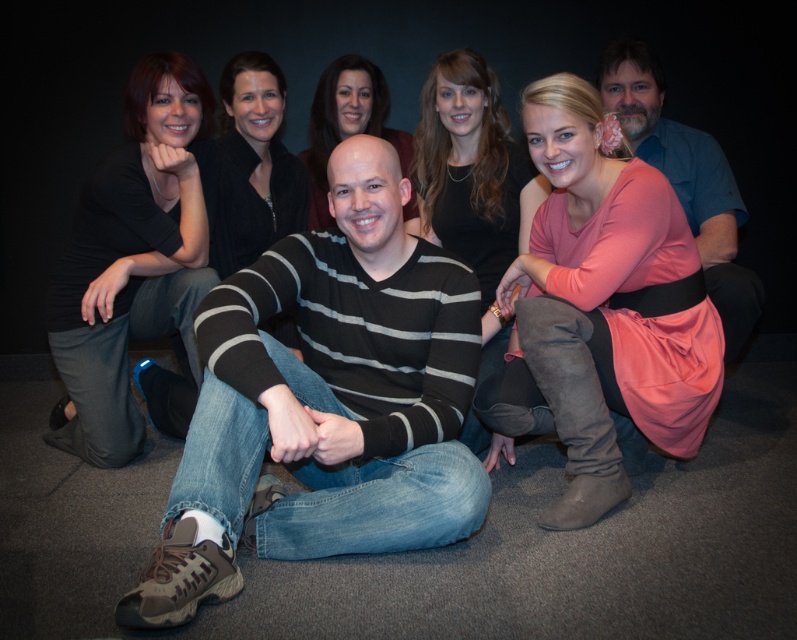
Which is more to the right, matte black shirt at left or matte black dress at center?

From the viewer's perspective, matte black dress at center appears more on the right side.

Who is more distant from viewer, [132,225] or [499,330]?

Positioned behind is point [499,330].

Where is `matte black shirt at left`? The width and height of the screenshot is (797, 640). matte black shirt at left is located at coordinates (132, 259).

This screenshot has height=640, width=797. In order to click on matte black shirt at left in this screenshot , I will do `click(132, 259)`.

Is point (279, 241) behind point (646, 60)?

No, (279, 241) is in front of (646, 60).

Is point (203, 392) closer to viewer compared to point (622, 120)?

That is True.

Between point (303, 435) and point (631, 54), which one is positioned behind?

Point (631, 54)

The width and height of the screenshot is (797, 640). What are the coordinates of `striped sweater at center` in the screenshot? It's located at (326, 401).

Can you confirm if matte black shirt at left is wider than blue denim shirt at upper right?

Indeed, matte black shirt at left has a greater width compared to blue denim shirt at upper right.

Can you confirm if matte black shirt at left is positioned below blue denim shirt at upper right?

Correct, matte black shirt at left is located below blue denim shirt at upper right.

Where is `matte black shirt at left`? matte black shirt at left is located at coordinates (132, 259).